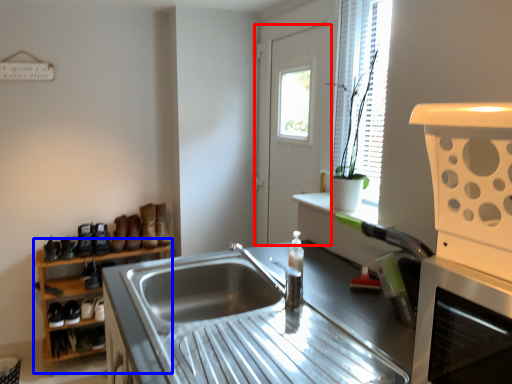
Question: Which object appears farthest to the camera in this image, door (highlighted by a red box) or shelf (highlighted by a blue box)?

Choices:
 (A) door
 (B) shelf

Answer: (B)